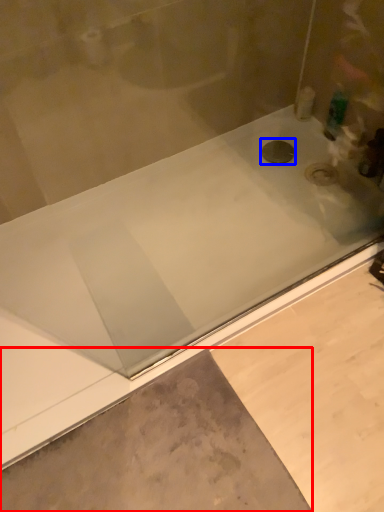
Question: Which of the following is the closest to the observer, concrete (highlighted by a red box) or drain (highlighted by a blue box)?

Choices:
 (A) concrete
 (B) drain

Answer: (A)